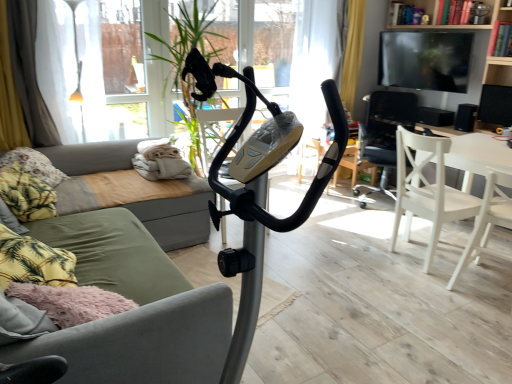
I want to click on vacant area that is in front of white wood chair at lower right, placed as the second chair when sorted from front to back, so click(429, 288).